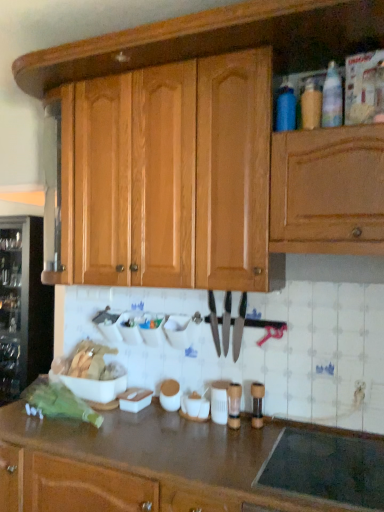
Identify the location of vacant space underneath black glass stovetop at lower right (from a real-world perspective). This screenshot has width=384, height=512. (323, 462).